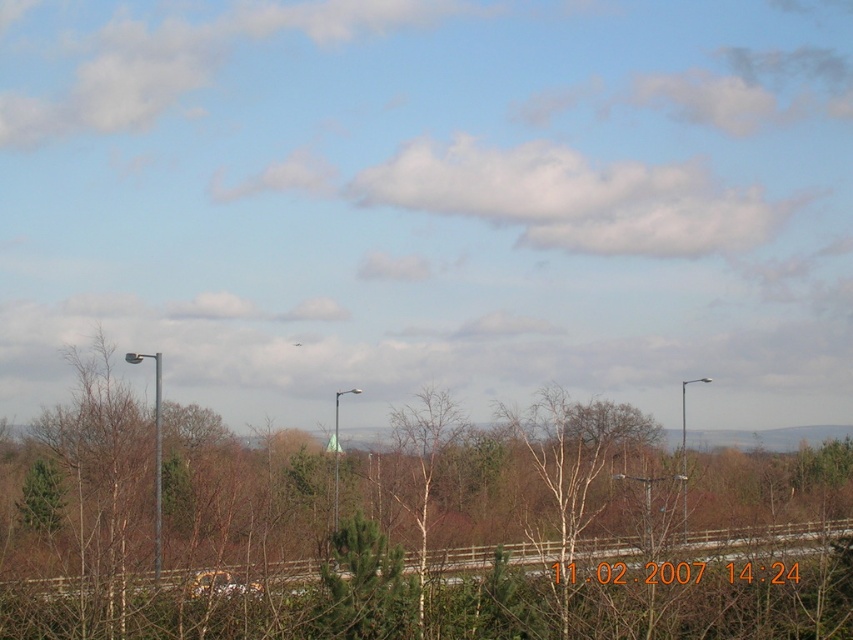
You are a pedestrian standing on the side of the road and see both the metallic pole at left and the metallic pole at right. Which pole is nearer to you?

The metallic pole at left is closer to the viewer than the metallic pole at right, so the metallic pole at left is nearer to you.